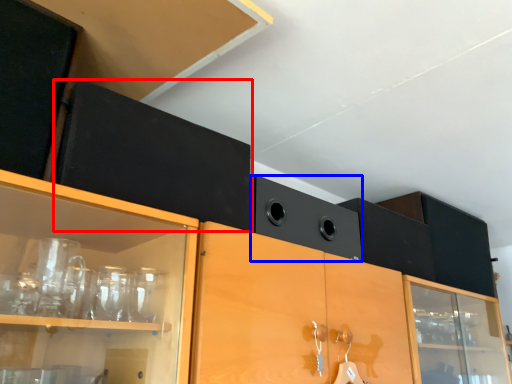
Question: Which of the following is the farthest to the observer, cabinetry (highlighted by a red box) or speaker (highlighted by a blue box)?

Choices:
 (A) cabinetry
 (B) speaker

Answer: (B)